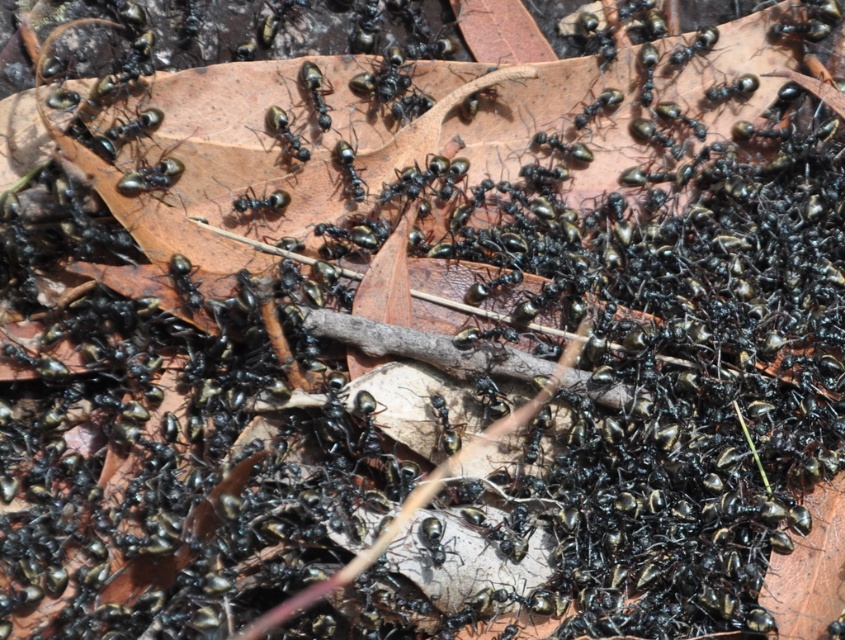
You are an entomologist observing the ants on the leaf. You notice two ants at the center of the scene. One is labeled as the shiny black ant at center and the other as the black shiny ant at center. Which of these two ants has a greater width?

The shiny black ant at center has a greater width than the black shiny ant at center.

You are an entomologist observing the ants on the leaf. You notice two ants labeled as shiny black ant at center and black shiny ant at center. Are these two ants the same individual? Please explain based on their positions.

The shiny black ant at center and black shiny ant at center are 4.27 inches apart, so they are not the same individual because they are separated by a significant distance.

You are an entomologist observing a cluster of ants on a leaf. You notice a specific point at coordinates (150, 177). Which object from the scene does this point belong to?

The point at coordinates (150, 177) belongs to the shiny black ant at center.